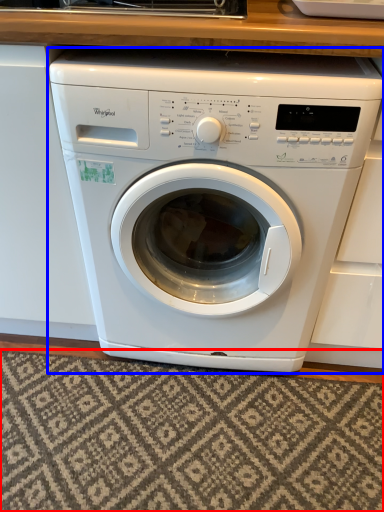
Question: Among these objects, which one is farthest to the camera, mat (highlighted by a red box) or washing machine (highlighted by a blue box)?

Choices:
 (A) mat
 (B) washing machine

Answer: (A)